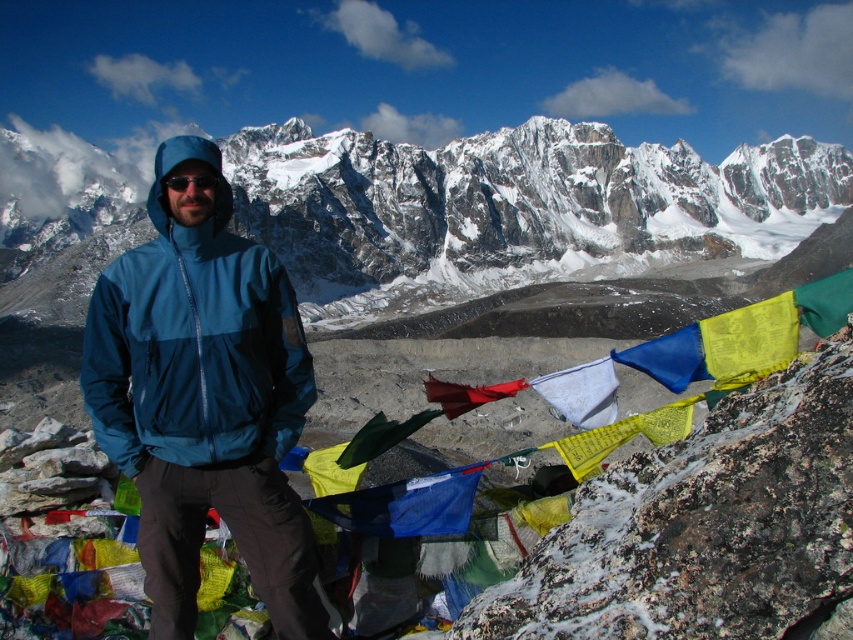
Question: Estimate the real-world distances between objects in this image. Which object is closer to the textured rock at center?

Choices:
 (A) red fabric flag at center
 (B) blue waterproof jacket at center

Answer: (A)

Question: Based on their relative distances, which object is farther from the red fabric flag at center?

Choices:
 (A) textured rock at center
 (B) blue waterproof jacket at center

Answer: (B)

Question: Can you confirm if matte blue jacket at center is wider than red fabric flag at center?

Choices:
 (A) yes
 (B) no

Answer: (A)

Question: In this image, where is textured rock at center located relative to blue waterproof jacket at center?

Choices:
 (A) above
 (B) below

Answer: (B)

Question: Estimate the real-world distances between objects in this image. Which object is closer to the matte blue jacket at center?

Choices:
 (A) red fabric flag at center
 (B) blue waterproof jacket at center
 (C) textured rock at center

Answer: (B)

Question: Can you confirm if textured rock at center is positioned below red fabric flag at center?

Choices:
 (A) no
 (B) yes

Answer: (B)